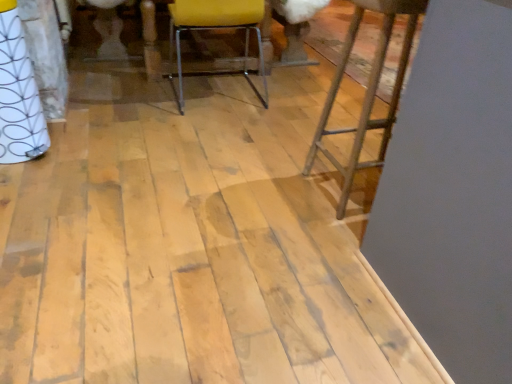
You are a GUI agent. You are given a task and a screenshot of the screen. Output one action in this format:
    pyautogui.click(x=<x>, y=<y>)
    Task: Click on the vacant space underneath rustic wood stool at right (from a real-world perspective)
    The width and height of the screenshot is (512, 384).
    Given the screenshot: What is the action you would take?
    pyautogui.click(x=351, y=188)